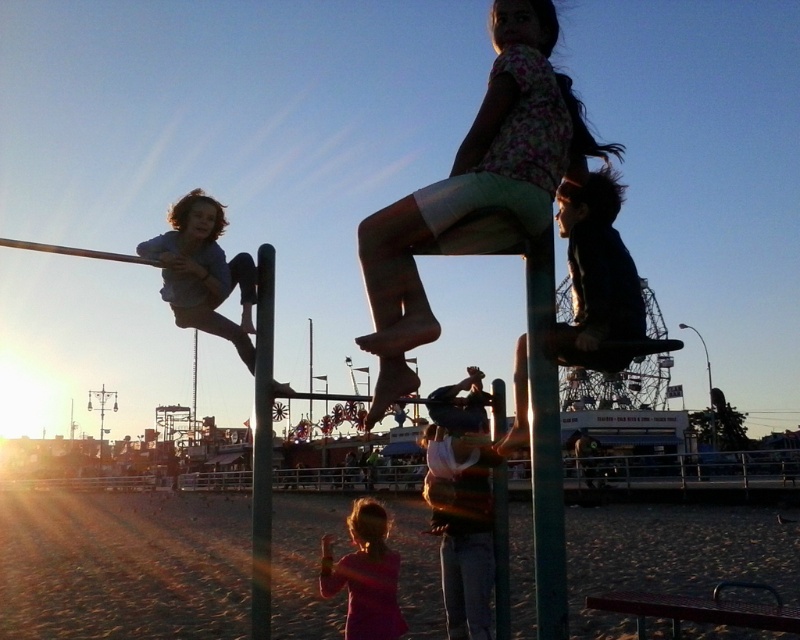
You are a photographer standing at the edge of the beach, aiming to capture a wide shot that includes both the floral fabric dress at upper center and the green textured pole at center. Given the distance between them, will you need to adjust your camera to a wider angle to ensure both are fully visible in the frame?

The distance between the floral fabric dress at upper center and the green textured pole at center is 67.46 feet, so yes, you will need to adjust your camera to a wider angle to ensure both are fully visible in the frame.

You are a photographer trying to capture the sunset at the beachside amusement park. You notice the floral fabric dress at upper center and the green textured pole at center in your frame. Which object is wider in the image?

The floral fabric dress at upper center is wider than the green textured pole at center according to the description.